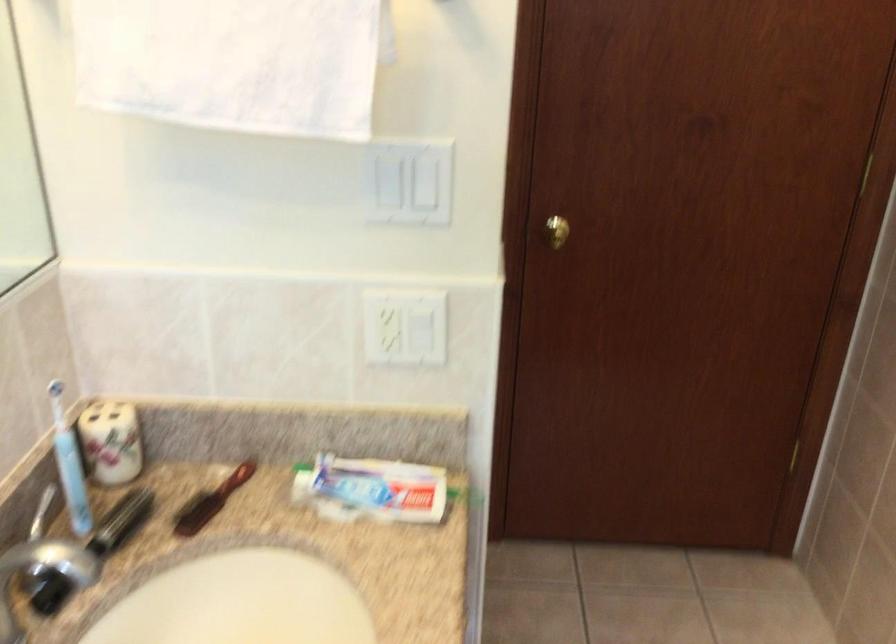
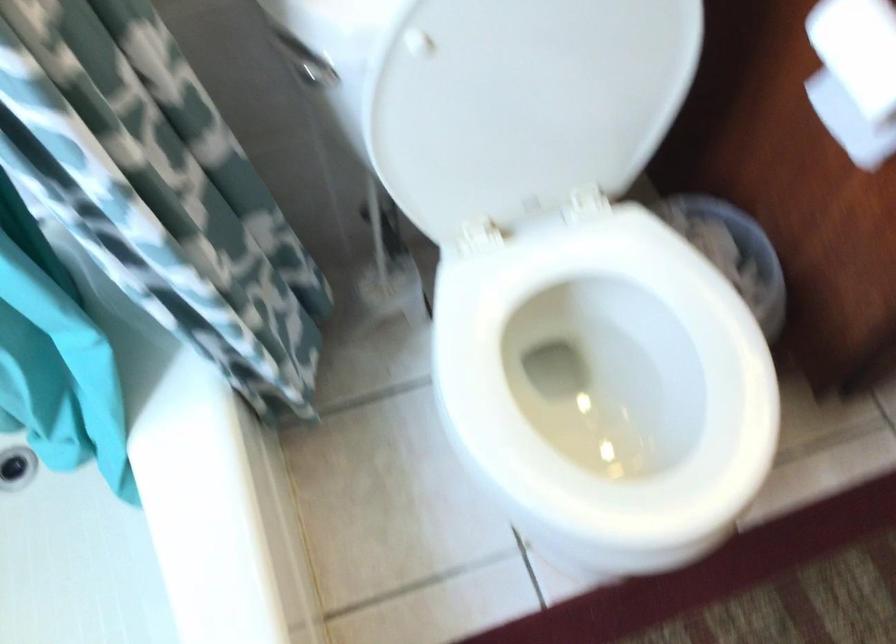
First-person continuous shooting, in which direction is the camera rotating?

The rotation direction of the camera is left-down.